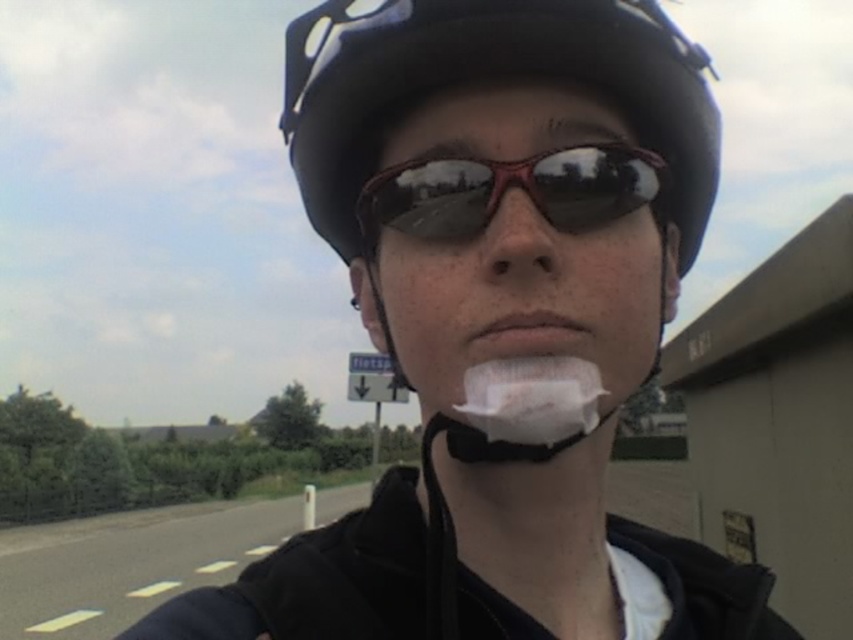
Question: Observing the image, what is the correct spatial positioning of shiny black goggles at center in reference to matte skin nose at center?

Choices:
 (A) above
 (B) below

Answer: (A)

Question: Which object is the farthest from the white matte shaving cream at center?

Choices:
 (A) matte skin nose at center
 (B) shiny black goggles at center
 (C) matte black helmet at center

Answer: (B)

Question: Considering the relative positions of matte black helmet at center and white matte shaving cream at center in the image provided, where is matte black helmet at center located with respect to white matte shaving cream at center?

Choices:
 (A) below
 (B) above

Answer: (B)

Question: Which point appears closest to the camera in this image?

Choices:
 (A) (575, 163)
 (B) (555, 433)
 (C) (564, 326)

Answer: (B)

Question: Among these objects, which one is farthest from the camera?

Choices:
 (A) matte skin nose at center
 (B) shiny black goggles at center

Answer: (B)

Question: Can you confirm if shiny black goggles at center is wider than matte skin nose at center?

Choices:
 (A) yes
 (B) no

Answer: (A)